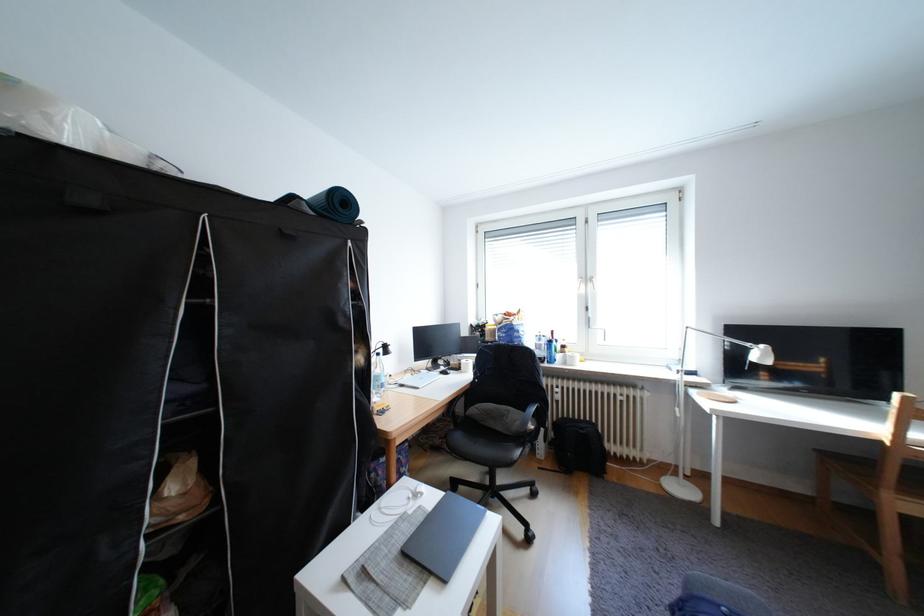
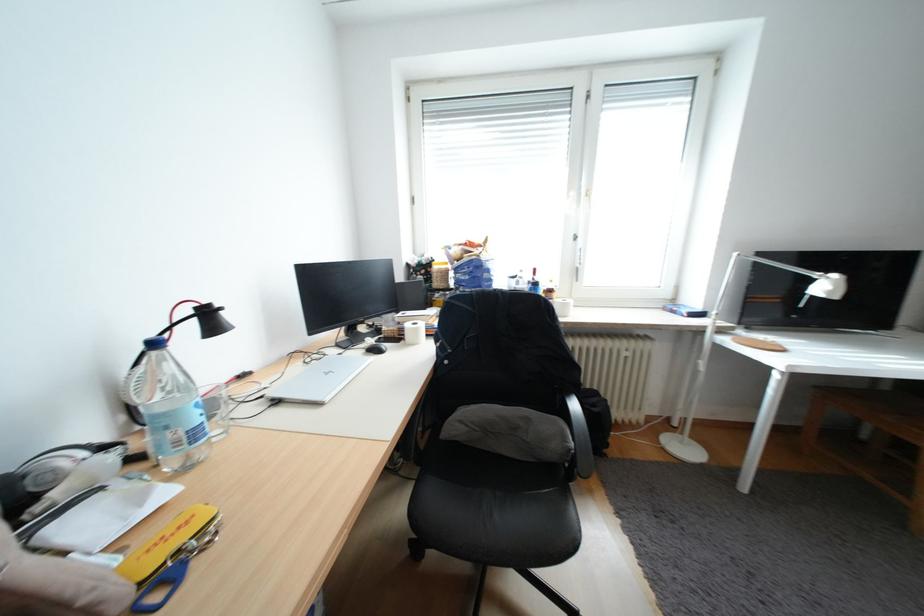
Question: In a continuous first-person perspective shot, in which direction is the camera moving?

Choices:
 (A) Left
 (B) Right
 (C) Forward
 (D) Backward

Answer: (C)